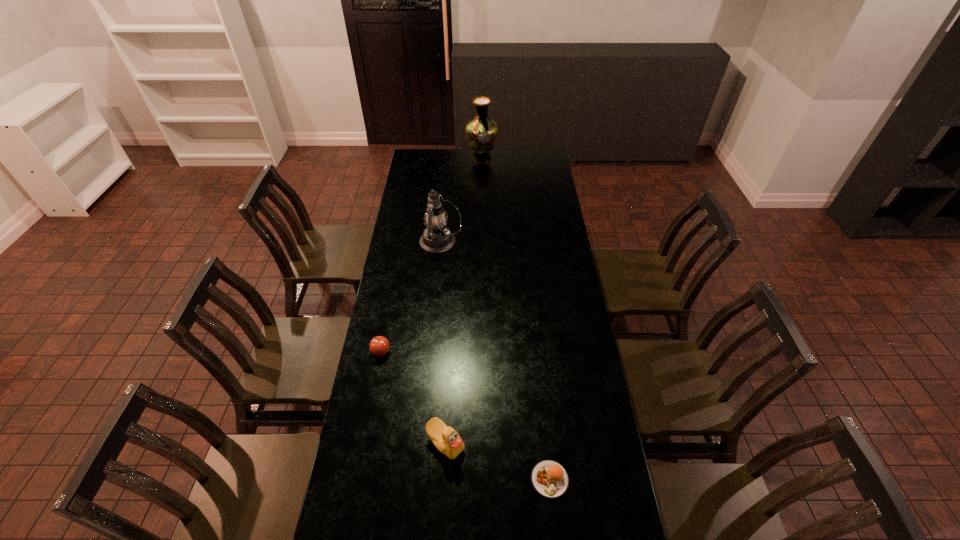
In the image, there is a desktop. Identify the location of vacant space at the right edge. (540, 197).

Locate an element on the screen. vacant space at the far left corner is located at coordinates (431, 162).

Find the location of `free space at the far right corner of the desktop`. free space at the far right corner of the desktop is located at coordinates (542, 155).

Locate an element on the screen. The width and height of the screenshot is (960, 540). free space between the patty and the oil lamp is located at coordinates coord(495,361).

This screenshot has width=960, height=540. In order to click on free space between the patty and the fourth shortest object in this screenshot , I will do `click(495, 361)`.

You are a GUI agent. You are given a task and a screenshot of the screen. Output one action in this format:
    pyautogui.click(x=<x>, y=<y>)
    Task: Click on the vacant region between the duck and the tallest object
    
    Given the screenshot: What is the action you would take?
    pyautogui.click(x=464, y=300)

Find the location of `free area in between the shortest object and the oil lamp`. free area in between the shortest object and the oil lamp is located at coordinates (495, 361).

Locate an element on the screen. The height and width of the screenshot is (540, 960). empty location between the duck and the leftmost object is located at coordinates (414, 397).

Where is `vacant point located between the apple and the duck`? The width and height of the screenshot is (960, 540). vacant point located between the apple and the duck is located at coordinates (414, 397).

Find the location of a particular element. The image size is (960, 540). vacant space in between the shortest object and the third nearest object is located at coordinates 466,415.